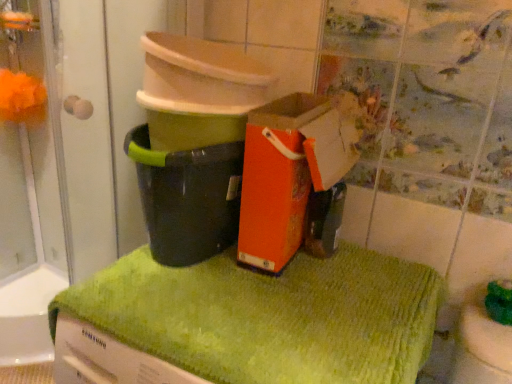
Question: Is orange paper bag at center wider or thinner than orange fuzzy ball at upper left?

Choices:
 (A) thin
 (B) wide

Answer: (B)

Question: Considering their positions, is orange paper bag at center located in front of or behind orange fuzzy ball at upper left?

Choices:
 (A) front
 (B) behind

Answer: (A)

Question: Estimate the real-world distances between objects in this image. Which object is closer to the green textured bath towel at center?

Choices:
 (A) orange paper bag at center
 (B) orange fuzzy ball at upper left
 (C) black plastic bucket at center

Answer: (A)

Question: Estimate the real-world distances between objects in this image. Which object is closer to the orange fuzzy ball at upper left?

Choices:
 (A) orange paper bag at center
 (B) green textured bath towel at center
 (C) black plastic bucket at center

Answer: (C)